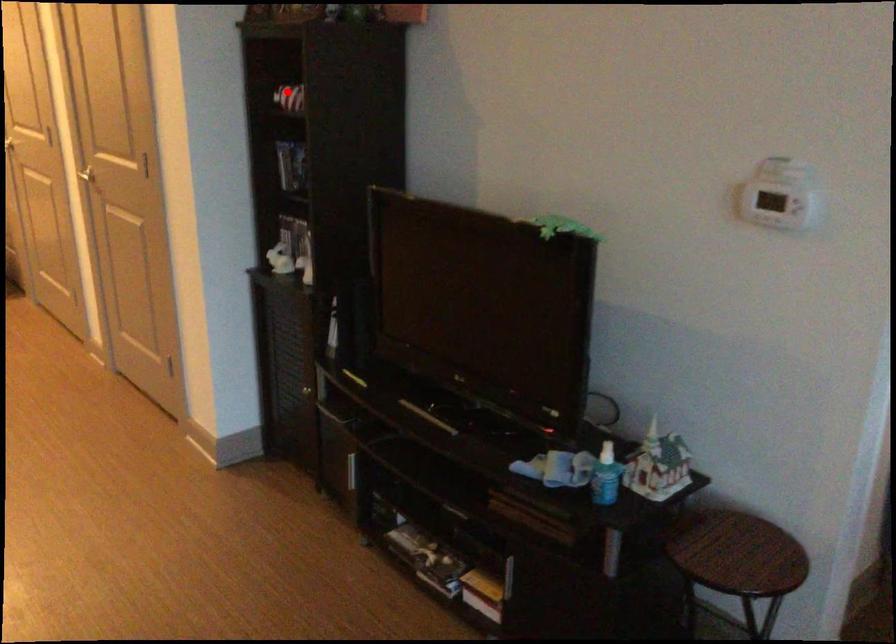
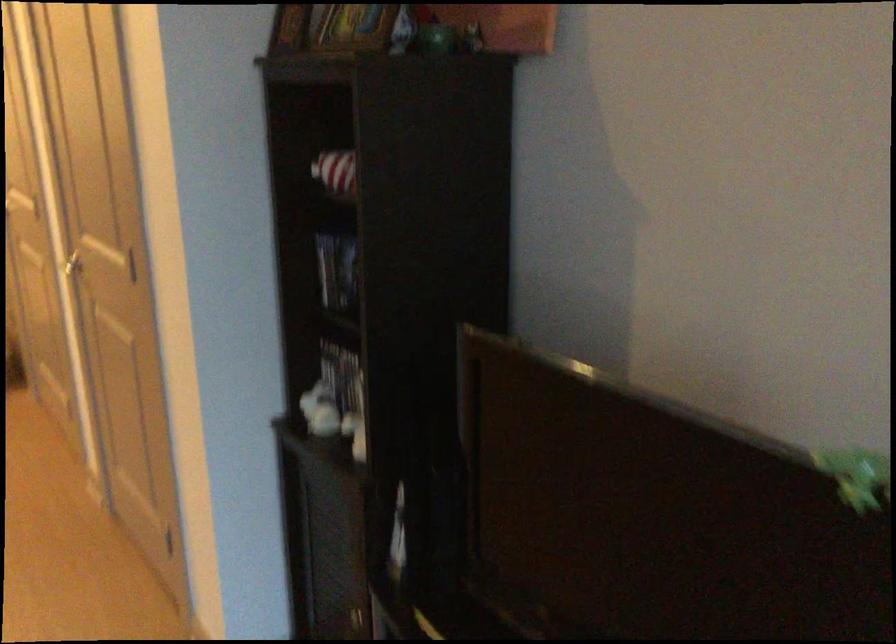
Locate, in the second image, the point that corresponds to the highlighted location in the first image.

(336, 172)